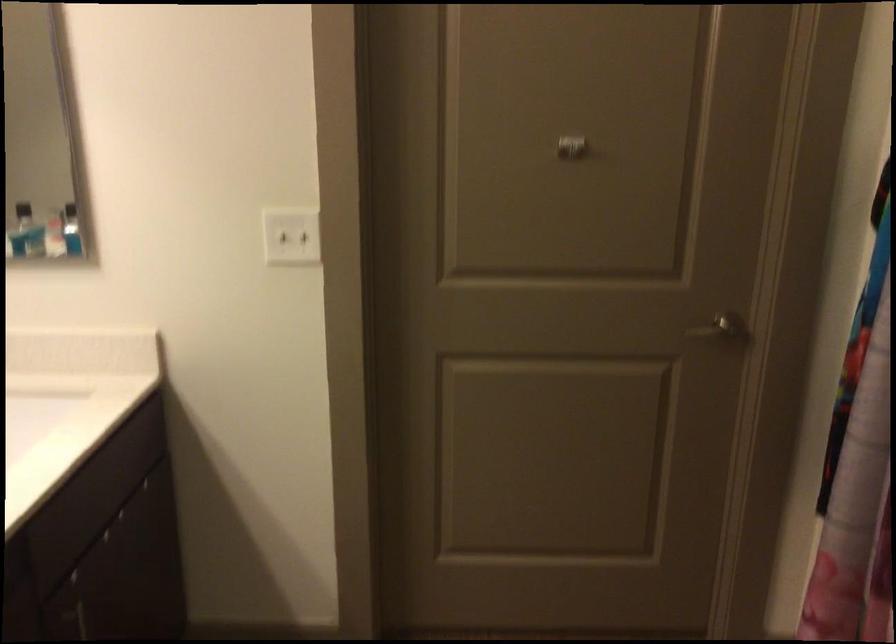
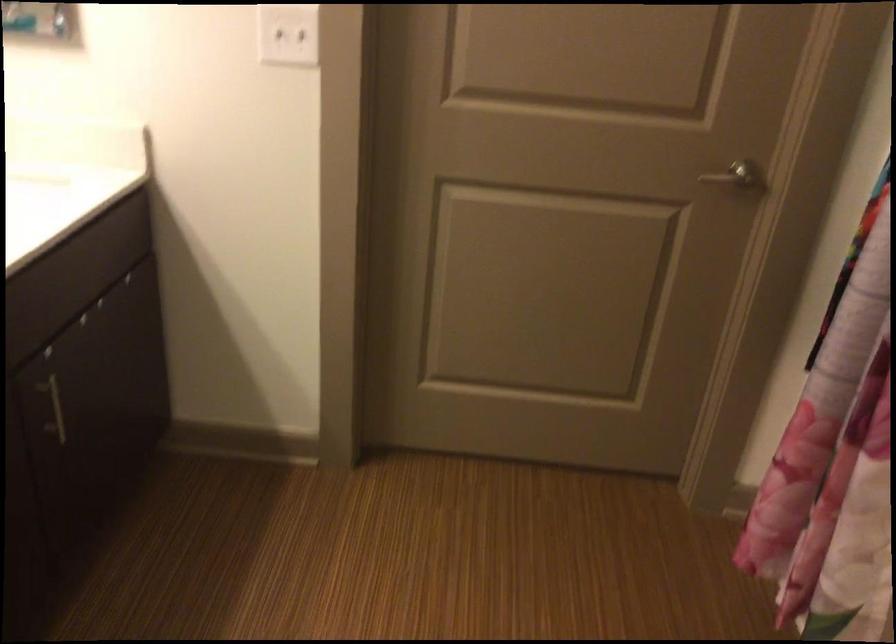
In the second image, find the point that corresponds to point 289,242 in the first image.

(288, 35)